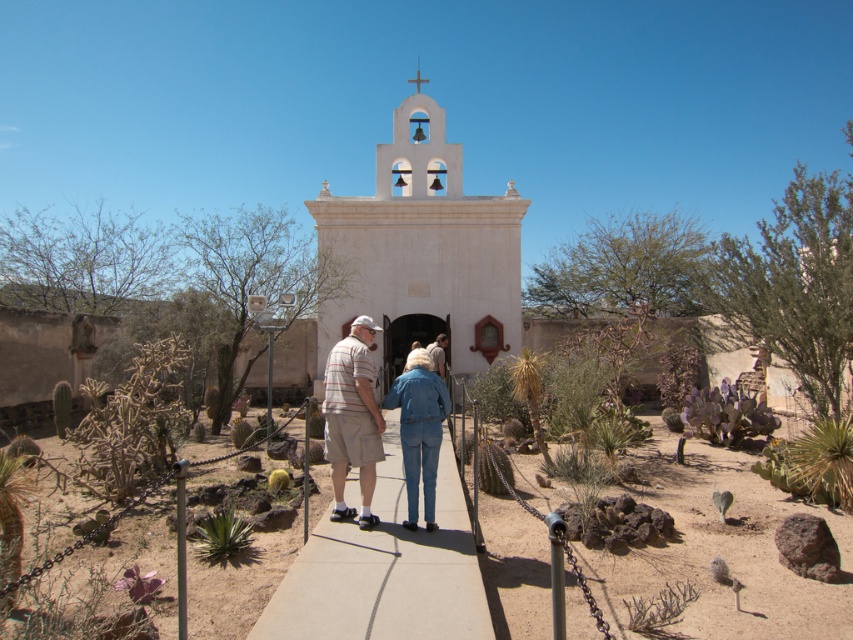
Is concrete sidewalk at center smaller than denim jeans at center?

Indeed, concrete sidewalk at center has a smaller size compared to denim jeans at center.

Based on the photo, who is shorter, concrete sidewalk at center or denim jeans at center?

concrete sidewalk at center is shorter.

What do you see at coordinates (386, 570) in the screenshot? I see `concrete sidewalk at center` at bounding box center [386, 570].

I want to click on concrete sidewalk at center, so click(x=386, y=570).

Is point (430, 365) positioned before point (410, 451)?

No, it is behind (410, 451).

Is point (431, 404) positioned behind point (418, 394)?

Yes, it is behind point (418, 394).

Identify the location of denim jacket at center. tap(419, 429).

Is white stucco chapel at center thinner than concrete sidewalk at center?

No, white stucco chapel at center is not thinner than concrete sidewalk at center.

Is point (357, 269) positioned after point (453, 515)?

Yes.

At what (x,y) coordinates should I click in order to perform the action: click on white stucco chapel at center. Please return your answer as a coordinate pair (x, y). Image resolution: width=853 pixels, height=640 pixels. Looking at the image, I should click on (422, 252).